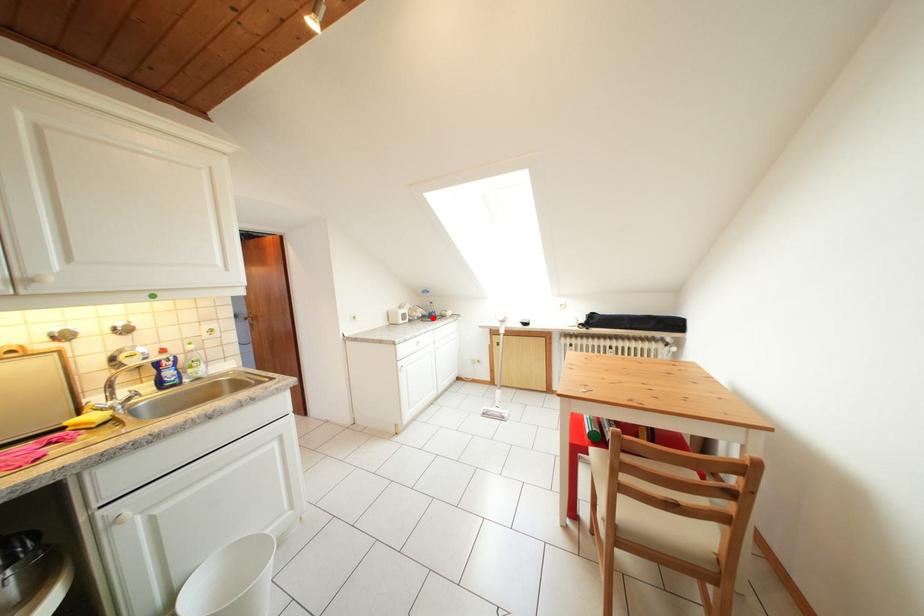
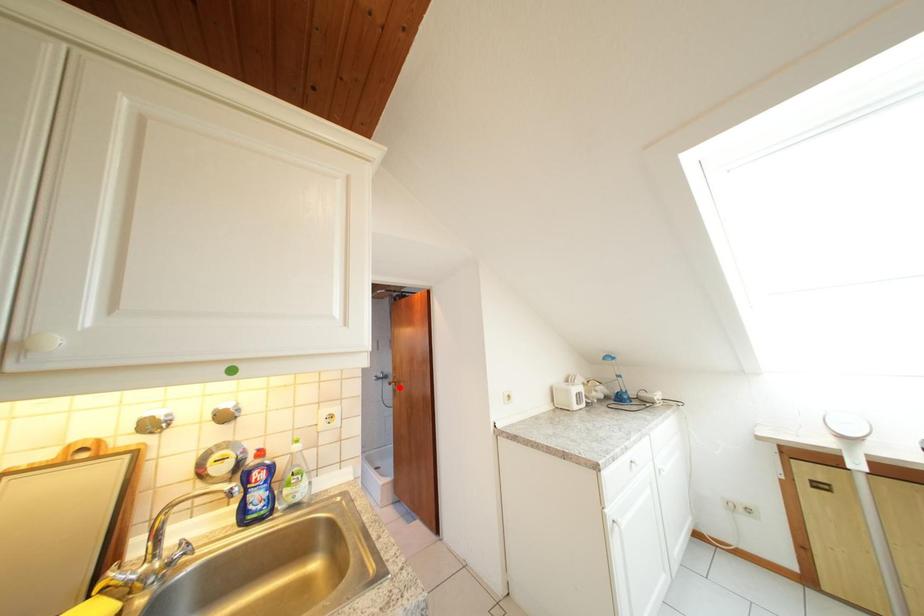
I am providing you with two images of the same scene from different viewpoints. A red point is marked on the first image and another point is marked on the second image. Are the points marked in image1 and image2 representing the same 3D position?

No